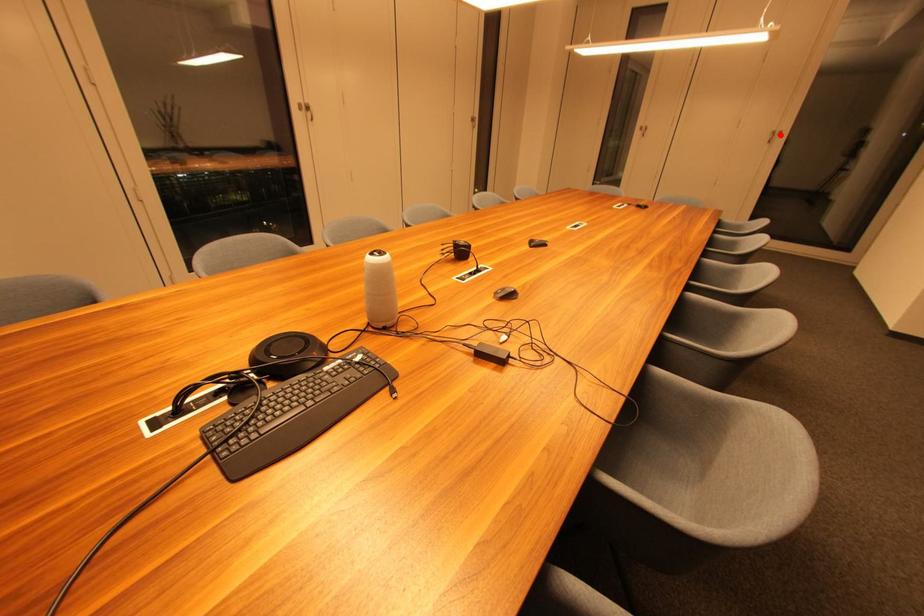
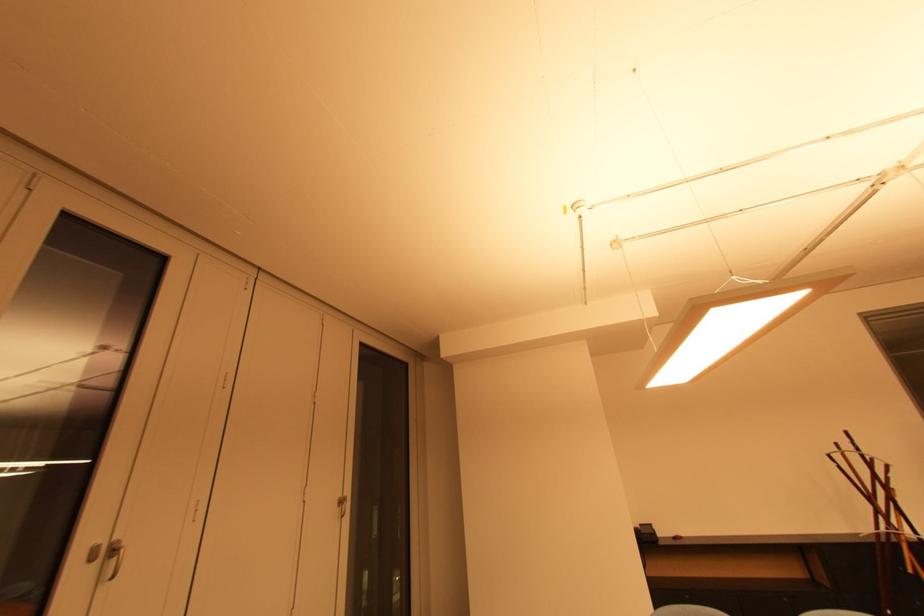
The point at the highlighted location is marked in the first image. Where is the corresponding point in the second image?

(346, 504)